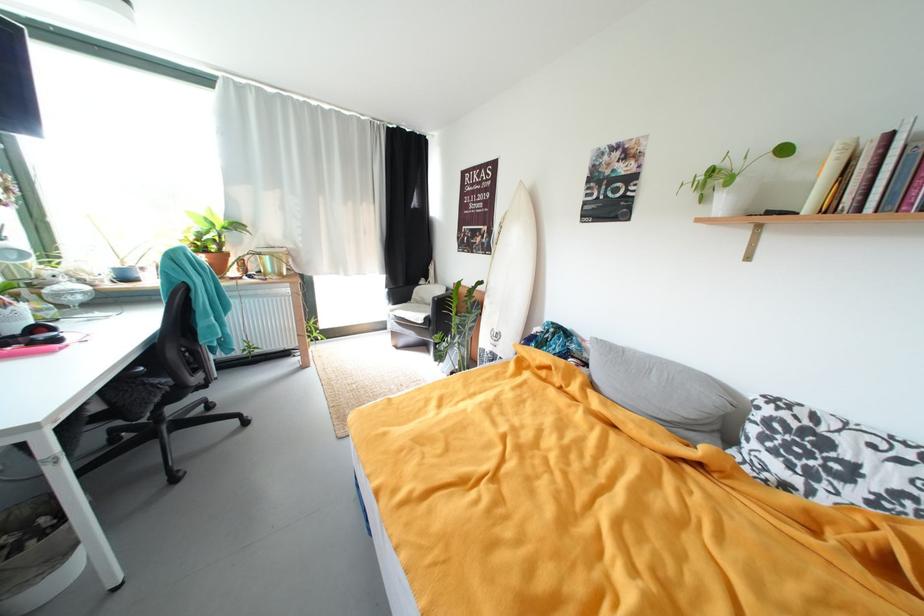
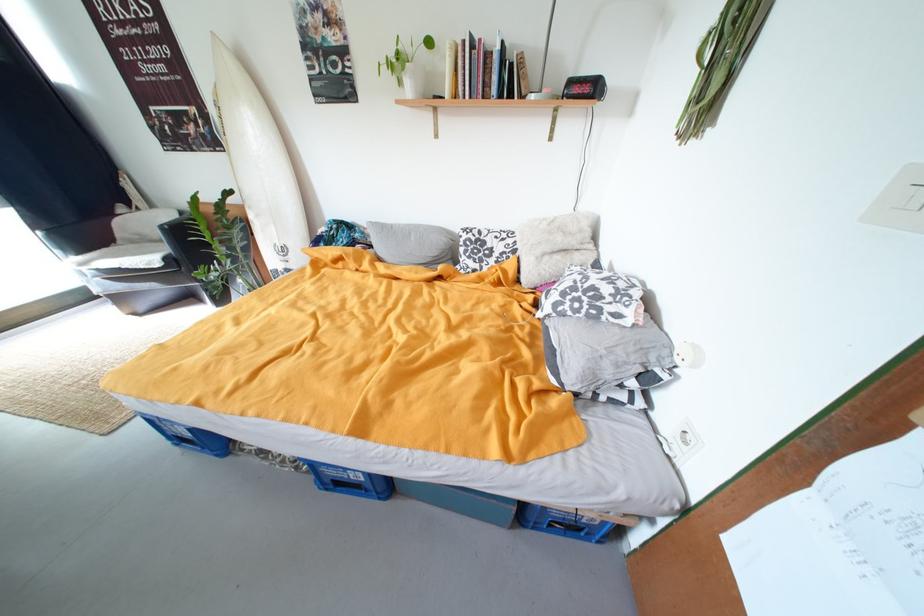
Locate, in the second image, the point that corresponds to the point at 588,347 in the first image.

(371, 235)